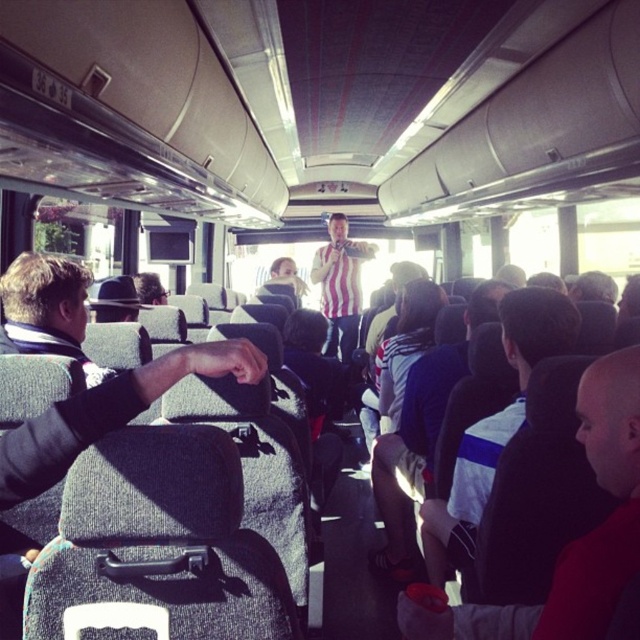
You are a passenger on the bus and want to see the man with the striped shirt at center. Is there an obstruction blocking your view caused by the dark gray fabric jacket at left?

The dark gray fabric jacket at left is not as tall as striped shirt at center, so the striped shirt at center is taller and would not be obstructed by the jacket.

You are a passenger sitting in the bus and want to locate the dark gray fabric jacket at left. According to the coordinates provided, where would you look to find it?

The dark gray fabric jacket at left is located at the 2D coordinates point (49, 308) in the image.